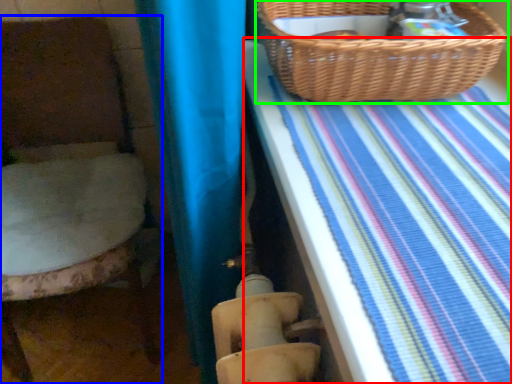
Question: Estimate the real-world distances between objects in this image. Which object is closer to sheet (highlighted by a red box), furniture (highlighted by a blue box) or picnic basket (highlighted by a green box)?

Choices:
 (A) furniture
 (B) picnic basket

Answer: (B)